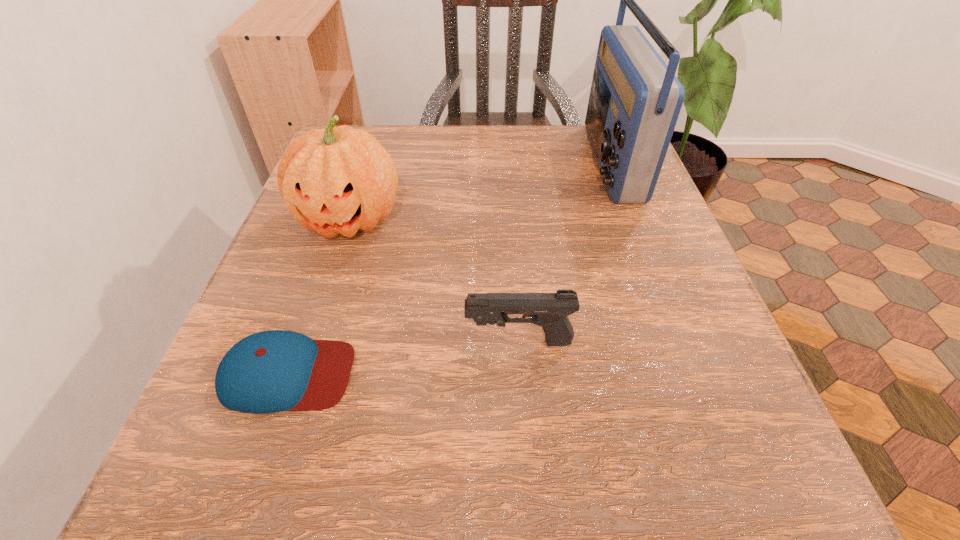
Identify the location of radio receiver. (635, 99).

Identify the location of the rightmost object. (635, 99).

The width and height of the screenshot is (960, 540). I want to click on the second tallest object, so [337, 180].

The height and width of the screenshot is (540, 960). In order to click on the second shortest object in this screenshot , I will do `click(548, 310)`.

Image resolution: width=960 pixels, height=540 pixels. In order to click on pistol in this screenshot , I will do `click(548, 310)`.

Locate an element on the screen. This screenshot has height=540, width=960. baseball cap is located at coordinates (271, 371).

What are the coordinates of `free spot located on the front panel of the tallest object` in the screenshot? It's located at (445, 161).

Locate an element on the screen. free space located on the front panel of the tallest object is located at coordinates (491, 161).

The image size is (960, 540). What are the coordinates of `free space located on the front panel of the tallest object` in the screenshot? It's located at (521, 161).

Find the location of `free space located 0.130m on the carved face of the third shortest object`. free space located 0.130m on the carved face of the third shortest object is located at coordinates (320, 312).